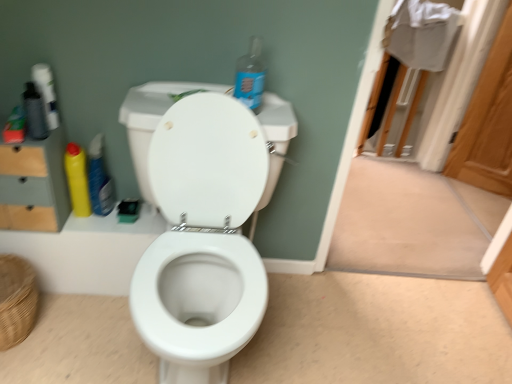
Question: From a real-world perspective, is yellow matte bottle at left, the third cleaning product from the right, beneath yellow plastic bottle at left, arranged as the second cleaning product when viewed from the left?

Choices:
 (A) no
 (B) yes

Answer: (A)

Question: Could you tell me if yellow matte bottle at left, which ranks as the 1th cleaning product in left-to-right order, is facing yellow plastic bottle at left, arranged as the second cleaning product when viewed from the left?

Choices:
 (A) yes
 (B) no

Answer: (B)

Question: Considering the relative positions of yellow matte bottle at left, which ranks as the 1th cleaning product in left-to-right order, and yellow plastic bottle at left, arranged as the second cleaning product when viewed from the left, in the image provided, is yellow matte bottle at left, which ranks as the 1th cleaning product in left-to-right order, to the right of yellow plastic bottle at left, arranged as the second cleaning product when viewed from the left, from the viewer's perspective?

Choices:
 (A) no
 (B) yes

Answer: (A)

Question: Could yellow plastic bottle at left, arranged as the second cleaning product when viewed from the left, be considered to be inside yellow matte bottle at left, which ranks as the 1th cleaning product in left-to-right order?

Choices:
 (A) no
 (B) yes

Answer: (A)

Question: Would you say yellow matte bottle at left, the third cleaning product from the right, is outside yellow plastic bottle at left, marked as the 2th cleaning product in a right-to-left arrangement?

Choices:
 (A) yes
 (B) no

Answer: (A)

Question: Does yellow matte bottle at left, which ranks as the 1th cleaning product in left-to-right order, have a larger size compared to yellow plastic bottle at left, marked as the 2th cleaning product in a right-to-left arrangement?

Choices:
 (A) no
 (B) yes

Answer: (A)

Question: Is woven brown basket at lower left with wooden screen door at upper right?

Choices:
 (A) yes
 (B) no

Answer: (B)

Question: From a real-world perspective, is woven brown basket at lower left below wooden screen door at upper right?

Choices:
 (A) no
 (B) yes

Answer: (B)

Question: From the image's perspective, is woven brown basket at lower left over wooden screen door at upper right?

Choices:
 (A) no
 (B) yes

Answer: (A)

Question: Is woven brown basket at lower left to the right of wooden screen door at upper right from the viewer's perspective?

Choices:
 (A) yes
 (B) no

Answer: (B)

Question: Does woven brown basket at lower left have a greater width compared to wooden screen door at upper right?

Choices:
 (A) no
 (B) yes

Answer: (B)

Question: Can we say woven brown basket at lower left lies outside wooden screen door at upper right?

Choices:
 (A) no
 (B) yes

Answer: (B)

Question: From the image's perspective, would you say yellow matte bottle at left, the third cleaning product from the right, is shown under blue plastic bottle at upper center, the third cleaning product positioned from the left?

Choices:
 (A) no
 (B) yes

Answer: (B)